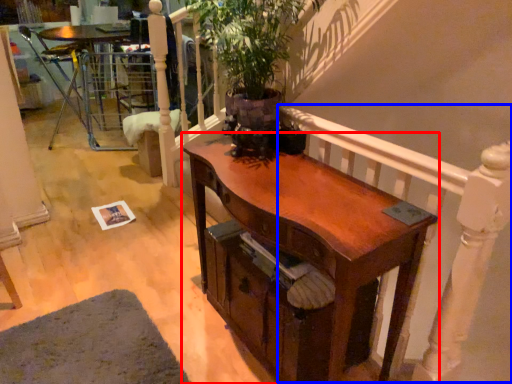
Question: Which of the following is the closest to the observer, desk (highlighted by a red box) or balustrade (highlighted by a blue box)?

Choices:
 (A) desk
 (B) balustrade

Answer: (B)